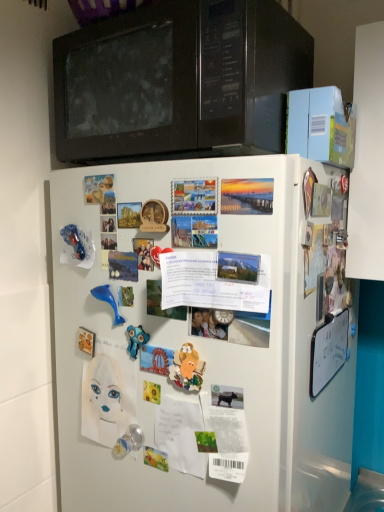
Question: Is blue rubber dolphin at center-left, which is the 1th toy in top-to-bottom order, positioned before transparent plastic toy at lower center, the third toy viewed from the right?

Choices:
 (A) yes
 (B) no

Answer: (A)

Question: From the image's perspective, is blue rubber dolphin at center-left, placed as the 4th toy when sorted from bottom to top, on top of transparent plastic toy at lower center, placed as the first toy when sorted from bottom to top?

Choices:
 (A) yes
 (B) no

Answer: (A)

Question: From a real-world perspective, is blue rubber dolphin at center-left, arranged as the 1th toy when viewed from the left, positioned under transparent plastic toy at lower center, the third toy viewed from the right, based on gravity?

Choices:
 (A) yes
 (B) no

Answer: (B)

Question: Can you confirm if blue rubber dolphin at center-left, which is the fourth toy in right-to-left order, is positioned to the left of transparent plastic toy at lower center, which is counted as the 4th toy, starting from the top?

Choices:
 (A) yes
 (B) no

Answer: (A)

Question: Is transparent plastic toy at lower center, the third toy viewed from the right, completely or partially inside blue rubber dolphin at center-left, arranged as the 1th toy when viewed from the left?

Choices:
 (A) yes
 (B) no

Answer: (B)

Question: In the image, is matte paper poster at upper left, which appears as the 2th poster when ordered from the bottom, positioned in front of or behind blue rubber dolphin at center-left, placed as the 4th toy when sorted from bottom to top?

Choices:
 (A) behind
 (B) front

Answer: (B)

Question: From the image's perspective, is matte paper poster at upper left, which ranks as the first poster in left-to-right order, above or below blue rubber dolphin at center-left, placed as the 4th toy when sorted from bottom to top?

Choices:
 (A) below
 (B) above

Answer: (B)

Question: From a real-world perspective, is matte paper poster at upper left, which appears as the 2th poster when ordered from the bottom, above or below blue rubber dolphin at center-left, arranged as the 1th toy when viewed from the left?

Choices:
 (A) below
 (B) above

Answer: (B)

Question: Is point (84, 178) closer or farther from the camera than point (112, 326)?

Choices:
 (A) farther
 (B) closer

Answer: (A)

Question: From the image's perspective, is white matte refrigerator at center positioned above or below blue rubber dolphin at center-left, arranged as the 1th toy when viewed from the left?

Choices:
 (A) below
 (B) above

Answer: (A)

Question: Is white matte refrigerator at center wider or thinner than blue rubber dolphin at center-left, which is the fourth toy in right-to-left order?

Choices:
 (A) thin
 (B) wide

Answer: (B)

Question: Considering their positions, is white matte refrigerator at center located in front of or behind blue rubber dolphin at center-left, which is the 1th toy in top-to-bottom order?

Choices:
 (A) behind
 (B) front

Answer: (B)

Question: Visually, is white matte refrigerator at center positioned to the left or to the right of blue rubber dolphin at center-left, placed as the 4th toy when sorted from bottom to top?

Choices:
 (A) right
 (B) left

Answer: (A)

Question: In the image, is matte paper poster at upper left, which appears as the 2th poster when ordered from the bottom, positioned in front of or behind white paper at center, which appears as the second poster when viewed from the top?

Choices:
 (A) behind
 (B) front

Answer: (A)

Question: From a real-world perspective, relative to white paper at center, marked as the 1th poster in a bottom-to-top arrangement, is matte paper poster at upper left, acting as the second poster starting from the right, vertically above or below?

Choices:
 (A) above
 (B) below

Answer: (A)